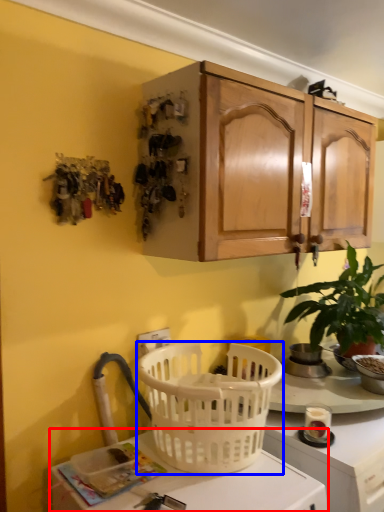
Question: Which object appears farthest to the camera in this image, desk (highlighted by a red box) or picnic basket (highlighted by a blue box)?

Choices:
 (A) desk
 (B) picnic basket

Answer: (B)